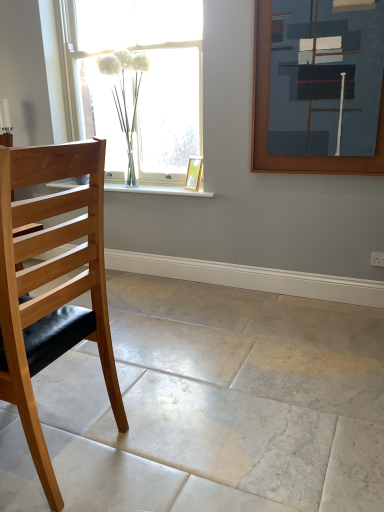
Locate an element on the screen. The width and height of the screenshot is (384, 512). blank space situated above white marble window sill at center (from a real-world perspective) is located at coordinates (x=149, y=187).